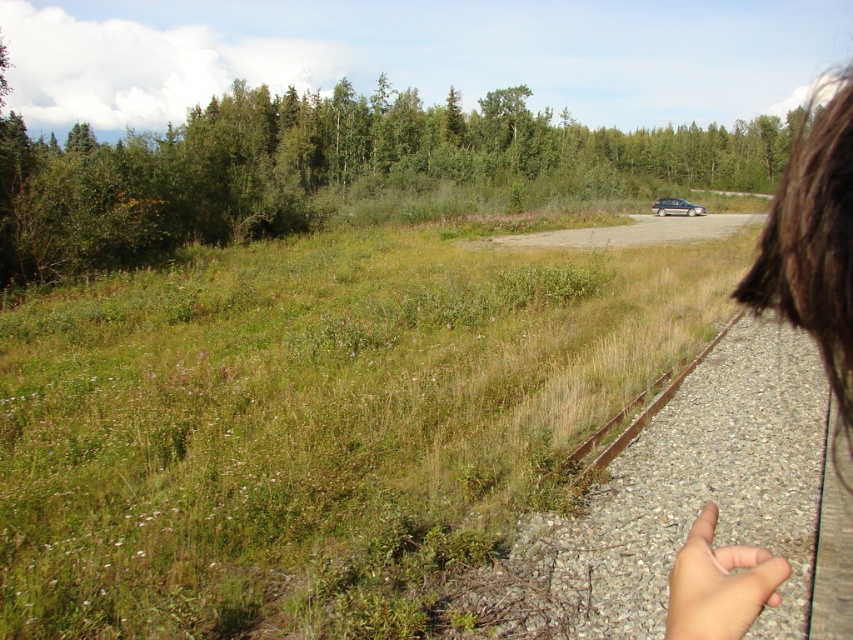
Does green leafy tree at upper center come in front of satin silver hatchback at far right?

Yes, green leafy tree at upper center is in front of satin silver hatchback at far right.

Is green leafy tree at upper center further to camera compared to satin silver hatchback at far right?

No.

Does point (283, 221) come farther from viewer compared to point (685, 202)?

That is False.

The height and width of the screenshot is (640, 853). I want to click on green leafy tree at upper center, so click(x=329, y=170).

Who is positioned more to the left, satin silver hatchback at far right or clear glass window at center?

clear glass window at center is more to the left.

Can you confirm if satin silver hatchback at far right is thinner than clear glass window at center?

In fact, satin silver hatchback at far right might be wider than clear glass window at center.

The width and height of the screenshot is (853, 640). Find the location of `satin silver hatchback at far right`. satin silver hatchback at far right is located at coordinates (676, 205).

Identify the location of satin silver hatchback at far right. (676, 205).

Is brown hair at upper right bigger than clear glass window at center?

Indeed, brown hair at upper right has a larger size compared to clear glass window at center.

Which is behind, point (793, 291) or point (665, 205)?

The point (665, 205) is behind.

Is point (846, 84) farther from viewer compared to point (659, 200)?

No, it is in front of (659, 200).

Identify the location of brown hair at upper right. (814, 250).